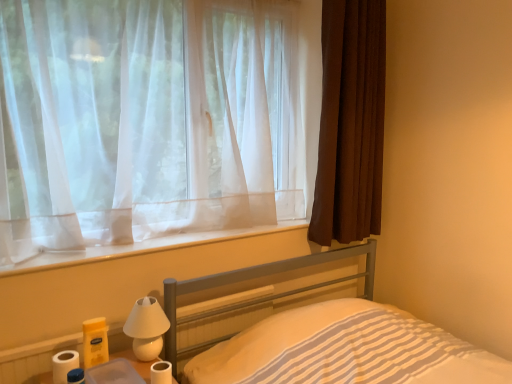
Question: Is metallic gray bed at lower center directly adjacent to white matte bedside lamp at lower left?

Choices:
 (A) yes
 (B) no

Answer: (B)

Question: Does metallic gray bed at lower center have a lesser height compared to white matte bedside lamp at lower left?

Choices:
 (A) no
 (B) yes

Answer: (A)

Question: Are metallic gray bed at lower center and white matte bedside lamp at lower left far apart?

Choices:
 (A) yes
 (B) no

Answer: (B)

Question: Considering the relative positions of metallic gray bed at lower center and white matte bedside lamp at lower left in the image provided, is metallic gray bed at lower center to the left of white matte bedside lamp at lower left from the viewer's perspective?

Choices:
 (A) no
 (B) yes

Answer: (A)

Question: Is metallic gray bed at lower center smaller than white matte bedside lamp at lower left?

Choices:
 (A) yes
 (B) no

Answer: (B)

Question: Is the position of metallic gray bed at lower center more distant than that of white matte bedside lamp at lower left?

Choices:
 (A) no
 (B) yes

Answer: (A)

Question: Is brown textured curtain at right, acting as the second curtain starting from the left, thinner than metallic gray bed at lower center?

Choices:
 (A) no
 (B) yes

Answer: (B)

Question: Does brown textured curtain at right, acting as the second curtain starting from the left, touch metallic gray bed at lower center?

Choices:
 (A) no
 (B) yes

Answer: (A)

Question: Is brown textured curtain at right, acting as the second curtain starting from the left, further to camera compared to metallic gray bed at lower center?

Choices:
 (A) no
 (B) yes

Answer: (B)

Question: Could you tell me if brown textured curtain at right, acting as the second curtain starting from the left, is turned towards metallic gray bed at lower center?

Choices:
 (A) no
 (B) yes

Answer: (A)

Question: Is brown textured curtain at right, the 1th curtain when ordered from right to left, to the left of metallic gray bed at lower center from the viewer's perspective?

Choices:
 (A) yes
 (B) no

Answer: (B)

Question: From the image's perspective, is brown textured curtain at right, acting as the second curtain starting from the left, under metallic gray bed at lower center?

Choices:
 (A) yes
 (B) no

Answer: (B)

Question: Is clear plastic container at lower left at the right side of white matte bedside lamp at lower left?

Choices:
 (A) no
 (B) yes

Answer: (A)